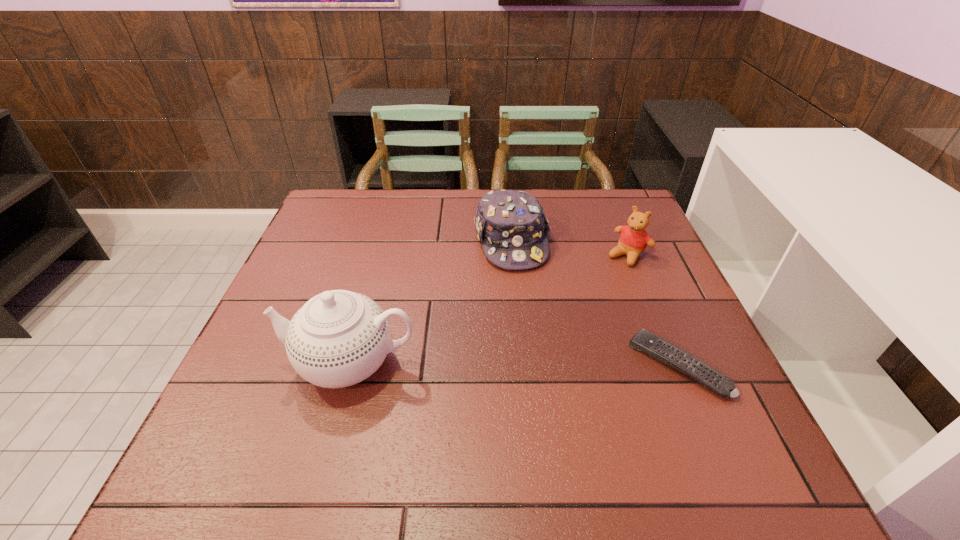
What are the coordinates of `free space on the desktop that is between the leftmost object and the shortest object and is positioned on the front-facing side of the second object from left to right` in the screenshot? It's located at (556, 364).

At what (x,y) coordinates should I click in order to perform the action: click on vacant spot on the desktop that is between the chinaware and the shortest object and is positioned on the front-facing side of the teddy bear. Please return your answer as a coordinate pair (x, y). Looking at the image, I should click on (519, 363).